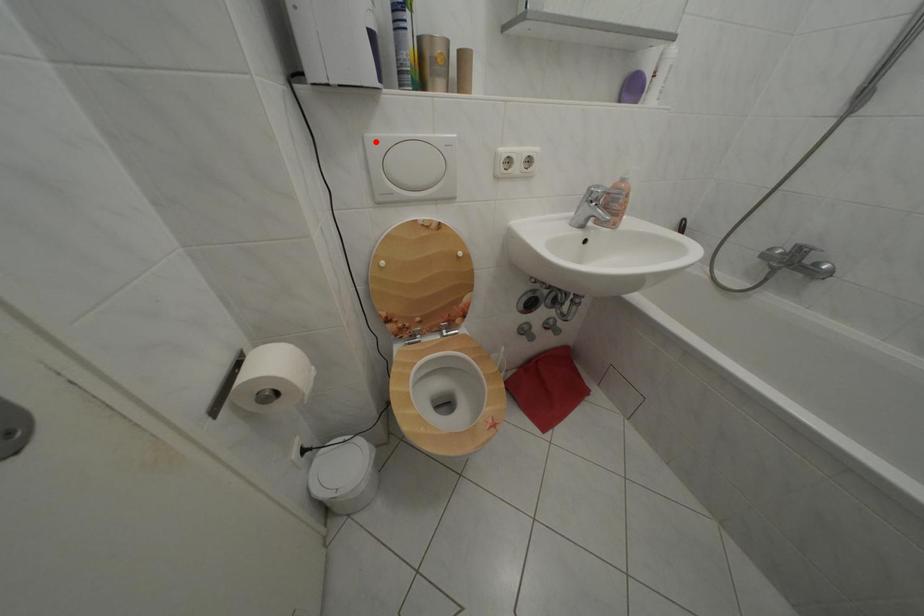
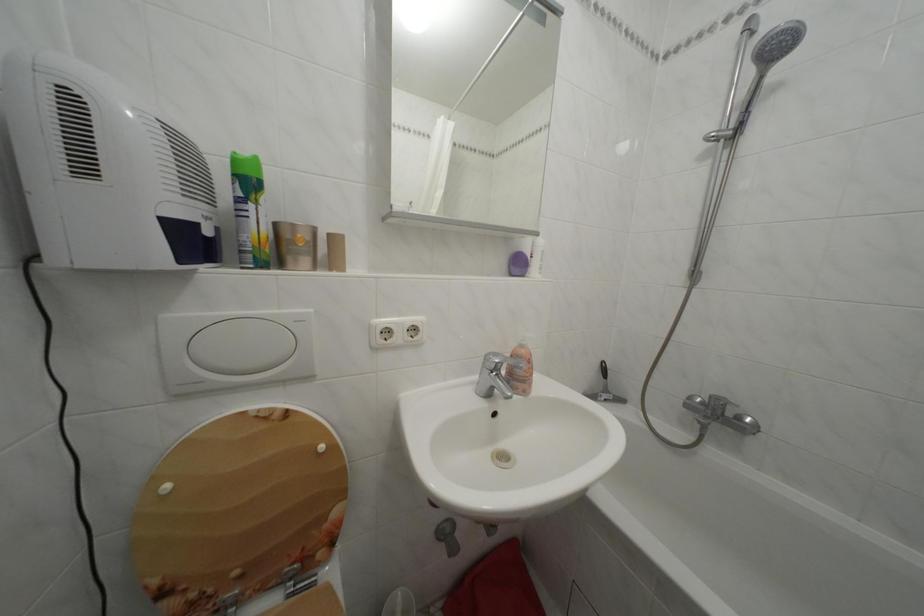
Find the pixel in the second image that matches the highlighted location in the first image.

(174, 323)